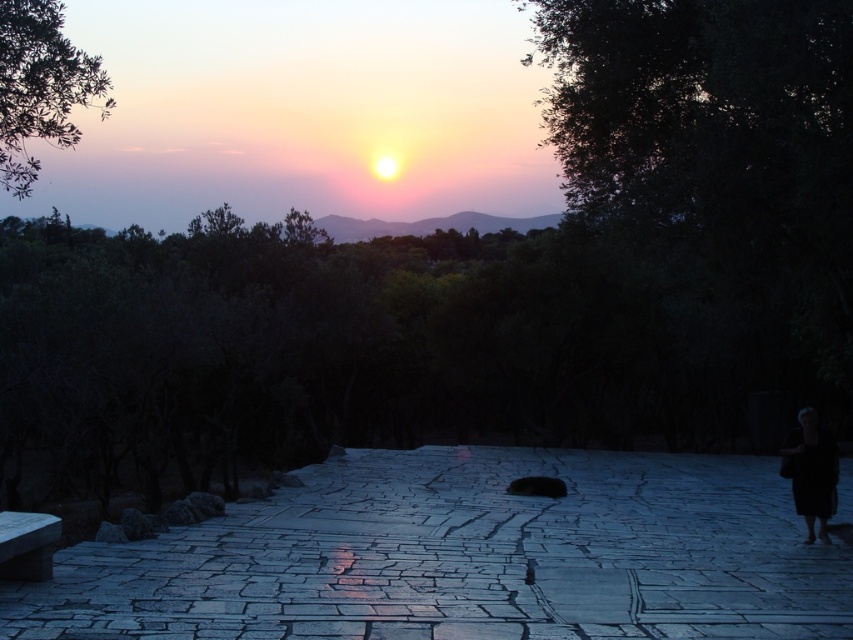
You are a photographer standing on the gray stone path at center and want to place your black fabric bag at lower right. Will the bag be visible from above the path?

The gray stone path at center has a greater height compared to black fabric bag at lower right, so the bag will not be visible from above the path because it is lower in height.

You are standing at the point marked as point (465, 557) in the image. What is the color of the surface you are currently standing on?

The point (465, 557) is on gray stone path at center, so the surface is gray.